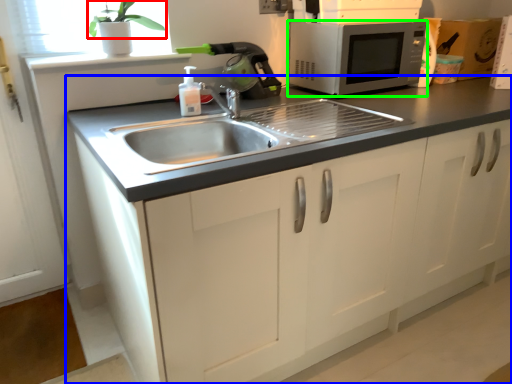
Question: Considering the real-world distances, which object is farthest from plant (highlighted by a red box)? cabinetry (highlighted by a blue box) or microwave oven (highlighted by a green box)?

Choices:
 (A) cabinetry
 (B) microwave oven

Answer: (A)